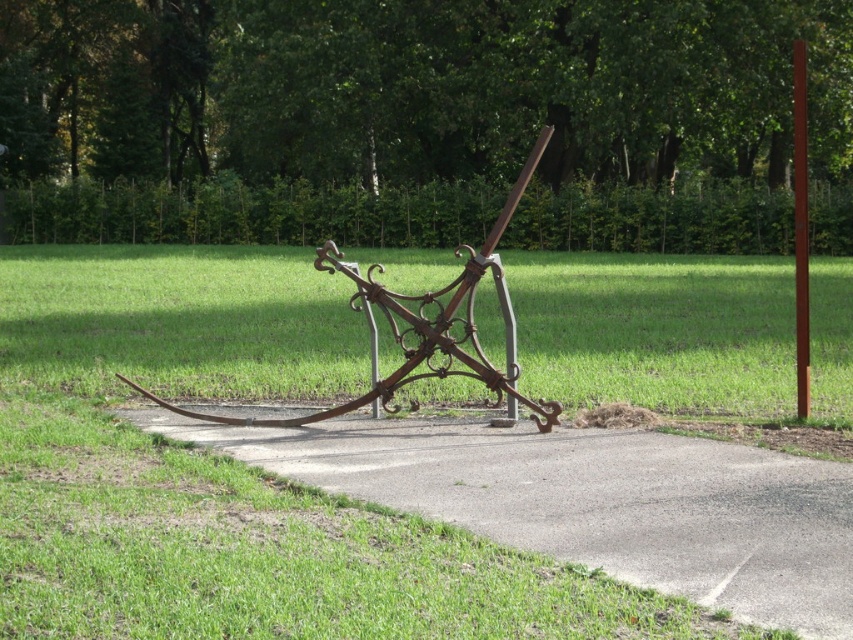
Question: Is gray concrete pavement at center positioned at the back of smooth brown pole at right?

Choices:
 (A) no
 (B) yes

Answer: (A)

Question: Which of the following is the closest to the observer?

Choices:
 (A) smooth brown pole at right
 (B) rusty wrought iron sculpture at center

Answer: (B)

Question: Estimate the real-world distances between objects in this image. Which object is closer to the gray concrete pavement at center?

Choices:
 (A) smooth brown pole at right
 (B) rusty wrought iron sculpture at center

Answer: (B)

Question: Can you confirm if gray concrete pavement at center is positioned to the right of smooth brown pole at right?

Choices:
 (A) no
 (B) yes

Answer: (A)

Question: Considering the relative positions of rusty wrought iron sculpture at center and smooth brown pole at right in the image provided, where is rusty wrought iron sculpture at center located with respect to smooth brown pole at right?

Choices:
 (A) above
 (B) below

Answer: (B)

Question: Which of these objects is positioned closest to the smooth brown pole at right?

Choices:
 (A) rusty wrought iron sculpture at center
 (B) gray concrete pavement at center

Answer: (A)